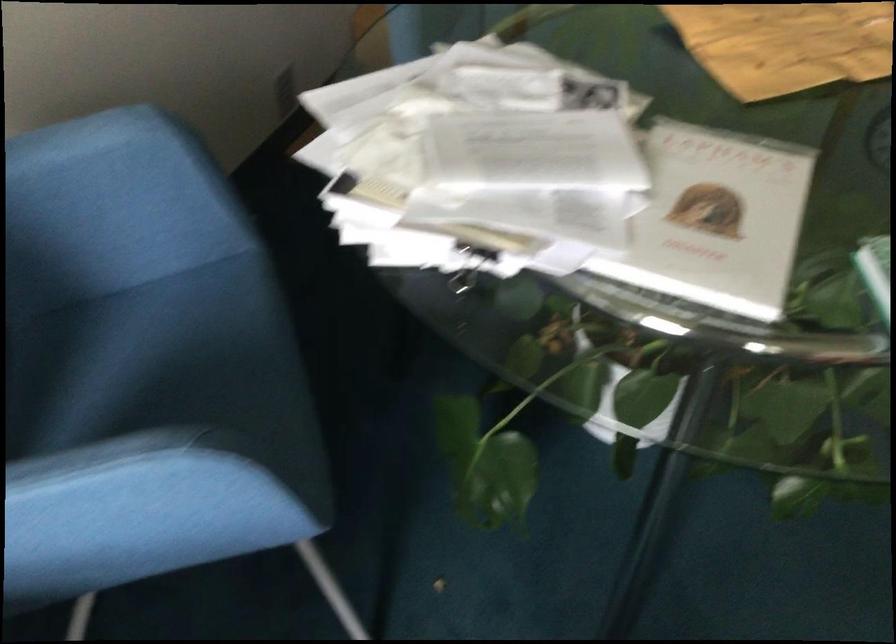
What do you see at coordinates (109, 162) in the screenshot?
I see `a blue chair armrest` at bounding box center [109, 162].